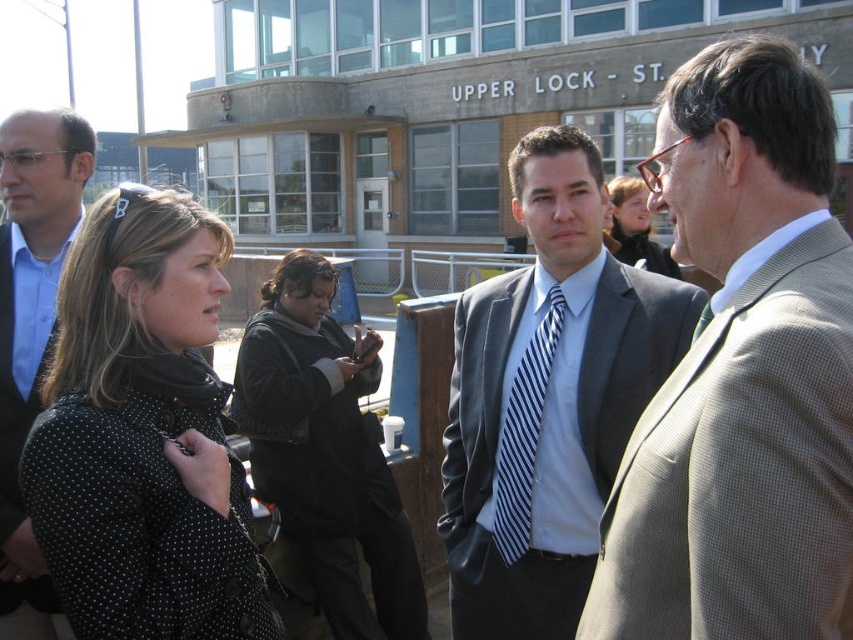
Is gray checkered suit at center above black fabric jacket at center?

Yes.

This screenshot has width=853, height=640. Find the location of `gray checkered suit at center`. gray checkered suit at center is located at coordinates coord(741,372).

You are a GUI agent. You are given a task and a screenshot of the screen. Output one action in this format:
    pyautogui.click(x=<x>, y=<y>)
    Task: Click on the gray checkered suit at center
    This screenshot has width=853, height=640.
    Given the screenshot: What is the action you would take?
    pyautogui.click(x=741, y=372)

Does gray checkered suit at center have a greater height compared to matte black suit at left?

No, gray checkered suit at center is not taller than matte black suit at left.

Is point (763, 401) more distant than point (0, 180)?

That is False.

I want to click on gray checkered suit at center, so click(741, 372).

Which is more to the left, gray checkered suit at center or dark gray suit at center?

dark gray suit at center

Between gray checkered suit at center and dark gray suit at center, which one is positioned lower?

dark gray suit at center is below.

Is point (699, 244) farther from viewer compared to point (613, 412)?

No, (699, 244) is in front of (613, 412).

At what (x,y) coordinates should I click in order to perform the action: click on gray checkered suit at center. Please return your answer as a coordinate pair (x, y). Looking at the image, I should click on (741, 372).